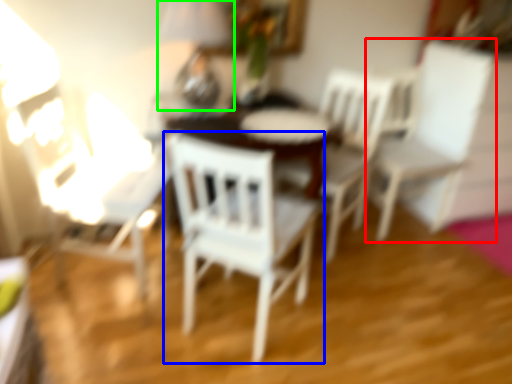
Question: Considering the real-world distances, which object is farthest from chair (highlighted by a red box)? chair (highlighted by a blue box) or table lamp (highlighted by a green box)?

Choices:
 (A) chair
 (B) table lamp

Answer: (B)